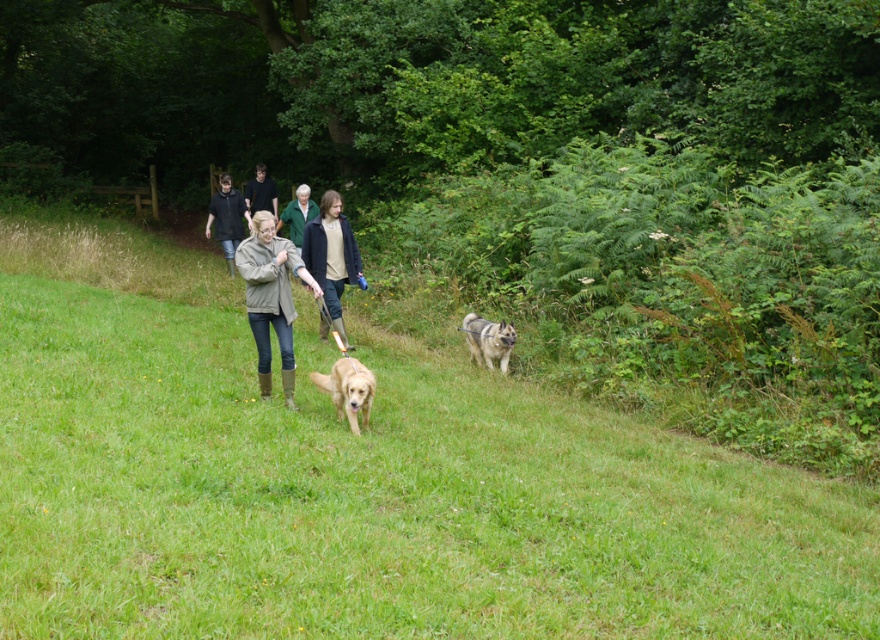
Which is behind, point (314, 248) or point (348, 410)?

The point (314, 248) is behind.

Find the location of `light brown leather jacket at center`. light brown leather jacket at center is located at coordinates (331, 259).

Between point (334, 259) and point (346, 408), which one is positioned behind?

The point (334, 259) is more distant.

You are a GUI agent. You are given a task and a screenshot of the screen. Output one action in this format:
    pyautogui.click(x=<x>, y=<y>)
    Task: Click on the light brown leather jacket at center
    The height and width of the screenshot is (640, 880).
    Given the screenshot: What is the action you would take?
    pyautogui.click(x=331, y=259)

Does golden matte dog at center have a lesser height compared to dark blue shirt at center?

In fact, golden matte dog at center may be taller than dark blue shirt at center.

Between point (368, 396) and point (260, 182), which one is positioned behind?

Positioned behind is point (260, 182).

Where is `golden matte dog at center`? The image size is (880, 640). golden matte dog at center is located at coordinates (348, 388).

From the picture: Can you confirm if green grassy at center is thinner than olive-green jacket at center?

No.

Which is more to the right, green grassy at center or olive-green jacket at center?

From the viewer's perspective, olive-green jacket at center appears more on the right side.

At what (x,y) coordinates should I click in order to perform the action: click on green grassy at center. Please return your answer as a coordinate pair (x, y). This screenshot has height=640, width=880. Looking at the image, I should click on (363, 483).